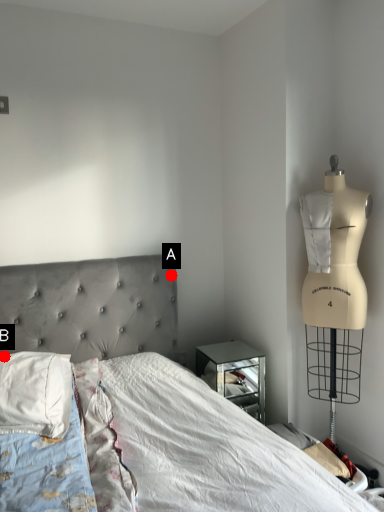
Question: Two points are circled on the image, labeled by A and B beside each circle. Among these points, which one is farthest from the camera?

Choices:
 (A) A is further
 (B) B is further

Answer: (A)